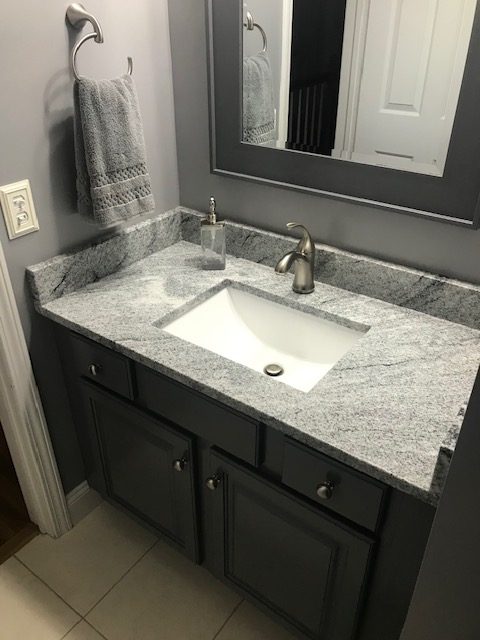
Locate an element on the screen. The height and width of the screenshot is (640, 480). floor tile is located at coordinates (128, 589).